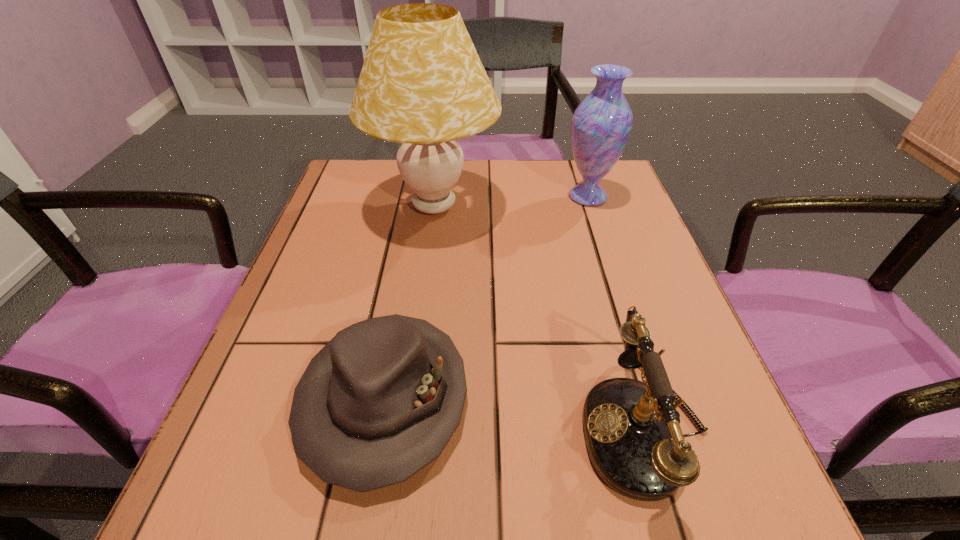
At what (x,y) coordinates should I click in order to perform the action: click on object located at the near right corner. Please return your answer as a coordinate pair (x, y). The image size is (960, 540). Looking at the image, I should click on (632, 429).

Image resolution: width=960 pixels, height=540 pixels. I want to click on blank area at the far edge, so click(557, 191).

Image resolution: width=960 pixels, height=540 pixels. Identify the location of blank space at the near edge. (358, 528).

Where is `vacant area at the left edge of the desktop`? vacant area at the left edge of the desktop is located at coordinates (348, 297).

Locate an element on the screen. The image size is (960, 540). vacant region at the right edge of the desktop is located at coordinates (728, 463).

In the image, there is a desktop. Identify the location of free region at the far left corner. (395, 196).

Image resolution: width=960 pixels, height=540 pixels. I want to click on vacant region at the far right corner of the desktop, so click(571, 169).

The width and height of the screenshot is (960, 540). In order to click on vacant space that is in between the hat and the vase in this screenshot , I will do `click(486, 298)`.

Where is `unoccupied position between the tallest object and the shortest object`? The height and width of the screenshot is (540, 960). unoccupied position between the tallest object and the shortest object is located at coordinates (409, 302).

The image size is (960, 540). Find the location of `free space that is in between the vase and the lampshade`. free space that is in between the vase and the lampshade is located at coordinates (511, 201).